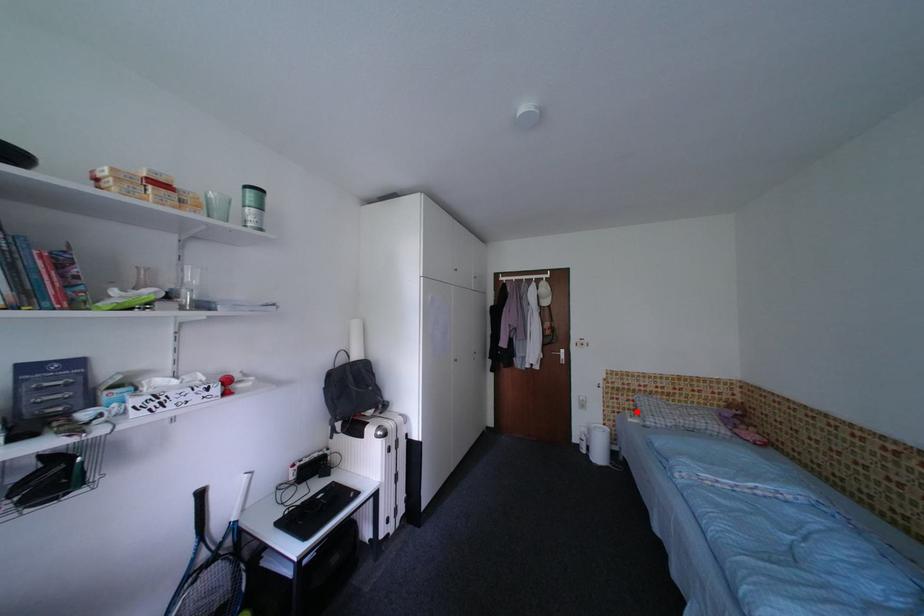
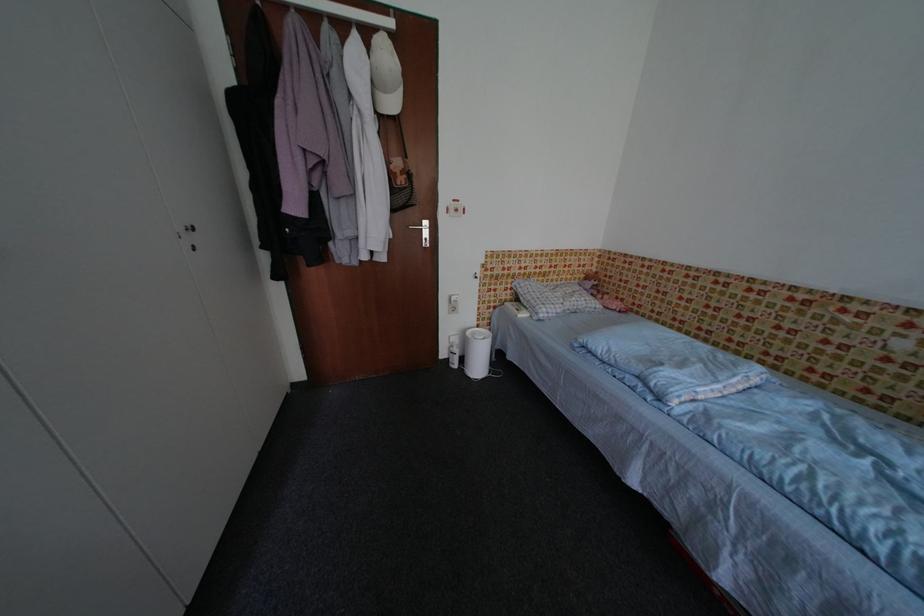
Find the pixel in the second image that matches the highlighted location in the first image.

(514, 302)